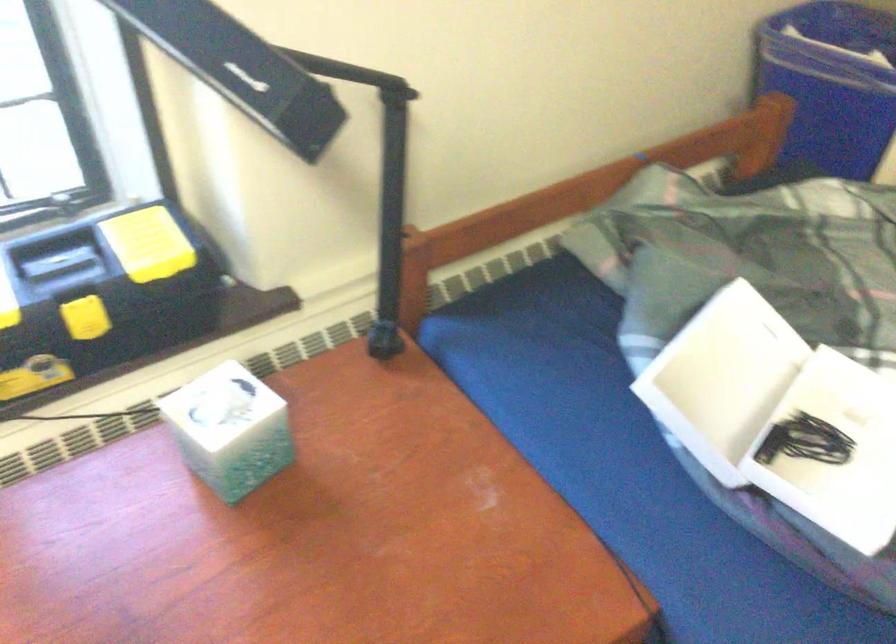
The width and height of the screenshot is (896, 644). Find the location of `white box lid`. white box lid is located at coordinates tap(728, 365).